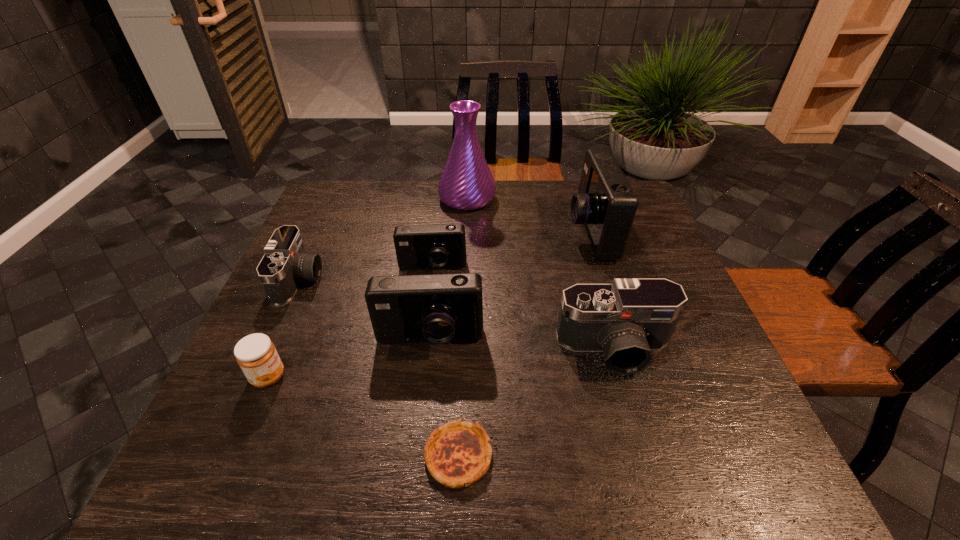
Find the location of a particular element. vacant space located on the front-facing side of the leftmost camera is located at coordinates (475, 280).

Image resolution: width=960 pixels, height=540 pixels. I want to click on free location located 0.280m on the front label of the jam, so click(422, 377).

Find the location of `vacant region located on the left of the shortest object`. vacant region located on the left of the shortest object is located at coordinates (346, 456).

Identify the location of vase that is at the far edge. (466, 183).

Where is `camera present at the far edge`? The height and width of the screenshot is (540, 960). camera present at the far edge is located at coordinates (605, 204).

At what (x,y) coordinates should I click in order to perform the action: click on object positioned at the near edge. Please return your answer as a coordinate pair (x, y). Looking at the image, I should click on (457, 454).

Identify the location of camera located at the left edge. This screenshot has height=540, width=960. (285, 264).

You are a GUI agent. You are given a task and a screenshot of the screen. Output one action in this format:
    pyautogui.click(x=<x>, y=<y>)
    Task: Click on the jam present at the left edge
    The image size is (960, 540).
    Given the screenshot: What is the action you would take?
    pyautogui.click(x=256, y=354)

This screenshot has width=960, height=540. Identify the location of object at the far right corner. (605, 204).

Find the location of `vacant space at the far edge of the desktop`. vacant space at the far edge of the desktop is located at coordinates (560, 202).